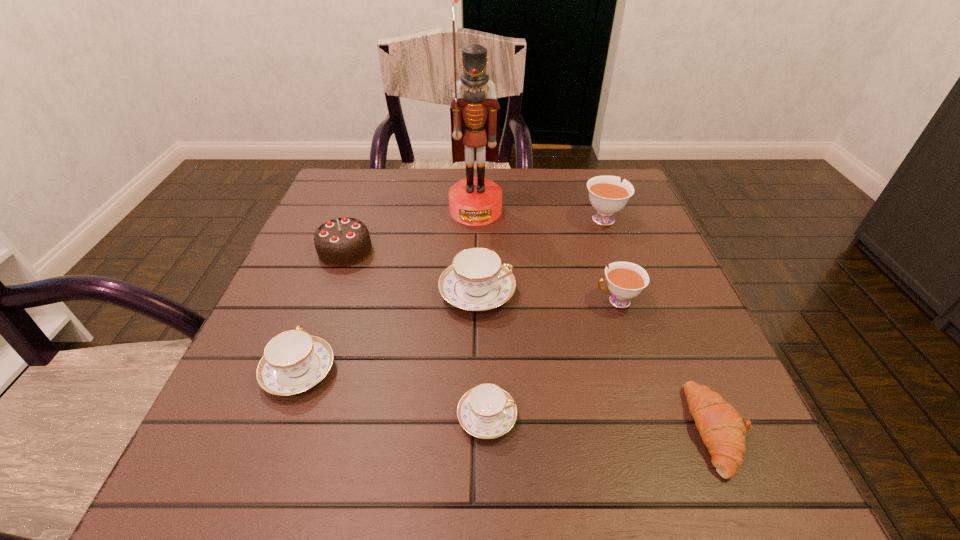
Choose which teacup is the nearest neighbor to the nearer white teacup. Please provide its 2D coordinates. Your answer should be formatted as a tuple, i.e. [(x, y)], where the tuple contains the x and y coordinates of a point satisfying the conditions above.

[(477, 280)]

Locate which blue teacup is the third closest to the crescent roll. Please provide its 2D coordinates. Your answer should be formatted as a tuple, i.e. [(x, y)], where the tuple contains the x and y coordinates of a point satisfying the conditions above.

[(294, 361)]

Identify which blue teacup is the nearest to the second smallest blue teacup. Please provide its 2D coordinates. Your answer should be formatted as a tuple, i.e. [(x, y)], where the tuple contains the x and y coordinates of a point satisfying the conditions above.

[(477, 280)]

Locate an element on the screen. vacant area that satisfies the following two spatial constraints: 1. on the side with the handle of the sixth nearest object; 2. on the left side of the leftmost blue teacup is located at coordinates (344, 250).

You are a GUI agent. You are given a task and a screenshot of the screen. Output one action in this format:
    pyautogui.click(x=<x>, y=<y>)
    Task: Click on the vacant space that satisfies the following two spatial constraints: 1. on the side with the handle of the shortest teacup; 2. on the right side of the crescent roll
    This screenshot has width=960, height=540.
    Given the screenshot: What is the action you would take?
    pyautogui.click(x=488, y=429)

Locate an element on the screen. vacant point that satisfies the following two spatial constraints: 1. on the side with the handle of the farthest blue teacup; 2. on the right side of the crescent roll is located at coordinates (476, 429).

Where is `vacant space that satisfies the following two spatial constraints: 1. on the side with the handle of the crescent roll; 2. on the right side of the smallest blue teacup`? The width and height of the screenshot is (960, 540). vacant space that satisfies the following two spatial constraints: 1. on the side with the handle of the crescent roll; 2. on the right side of the smallest blue teacup is located at coordinates 488,429.

What are the coordinates of `free location that satisfies the following two spatial constraints: 1. on the side with the handle of the shortest teacup; 2. on the back side of the crescent roll` in the screenshot? It's located at (488, 429).